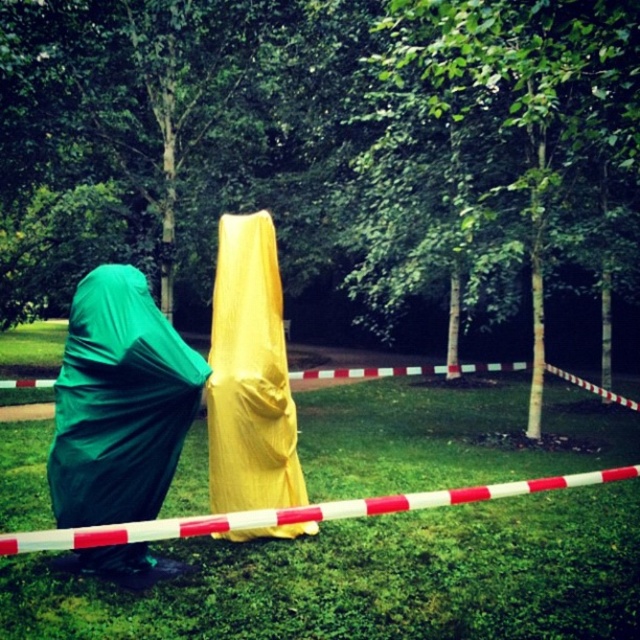
Does green grass at lower center have a lesser width compared to green fabric bag at left?

No.

Find the location of a particular element. The image size is (640, 640). green grass at lower center is located at coordinates (372, 579).

Is green fabric bag at left positioned behind yellow fabric cloak at center?

No, green fabric bag at left is in front of yellow fabric cloak at center.

Who is positioned more to the right, green fabric bag at left or yellow fabric cloak at center?

Positioned to the right is yellow fabric cloak at center.

Is point (147, 465) more distant than point (314, 522)?

No, it is in front of (314, 522).

Image resolution: width=640 pixels, height=640 pixels. I want to click on green fabric bag at left, so click(118, 403).

Between point (35, 460) and point (276, 378), which one is positioned behind?

The point (35, 460) is behind.

Locate an element on the screen. This screenshot has height=640, width=640. green grass at lower center is located at coordinates (372, 579).

The width and height of the screenshot is (640, 640). I want to click on green grass at lower center, so click(x=372, y=579).